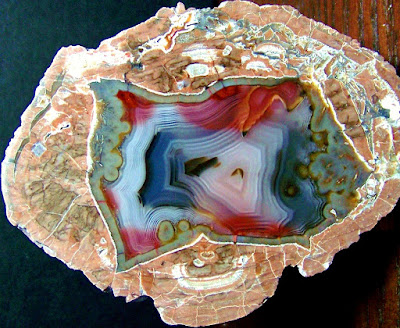
You are a GUI agent. You are given a task and a screenshot of the screen. Output one action in this format:
    pyautogui.click(x=<x>, y=<y>)
    Task: Click on the wood grain
    The height and width of the screenshot is (328, 400).
    Given the screenshot: What is the action you would take?
    pyautogui.click(x=380, y=318), pyautogui.click(x=365, y=322), pyautogui.click(x=361, y=31), pyautogui.click(x=375, y=41), pyautogui.click(x=331, y=16), pyautogui.click(x=388, y=16)